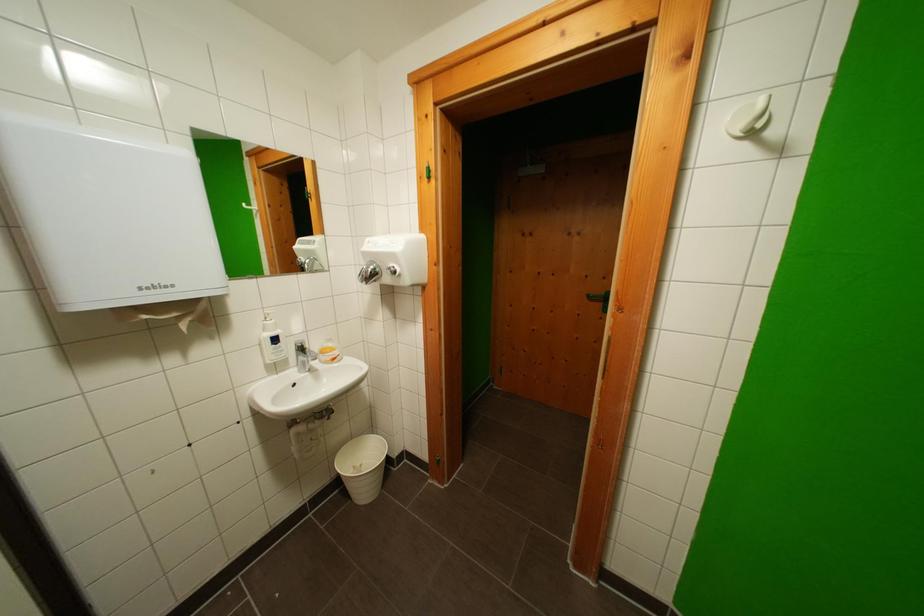
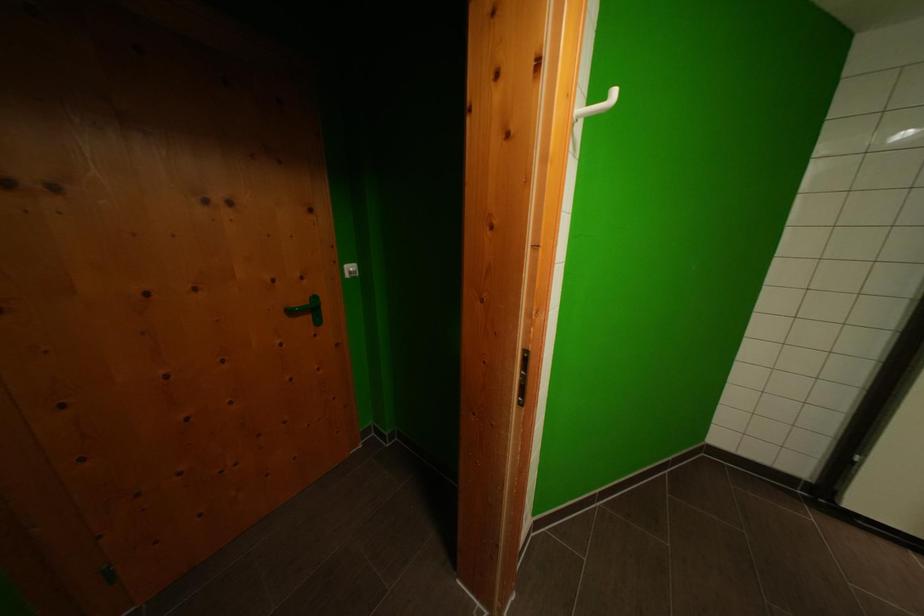
Locate, in the second image, the point that corresponds to [596,301] in the first image.

(297, 315)